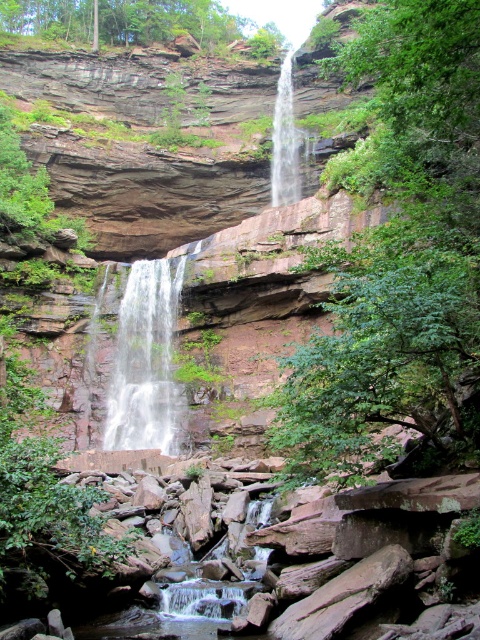
Who is shorter, smooth rock creek at lower center or white smooth waterfall at center?

With less height is smooth rock creek at lower center.

Who is more forward, (194,582) or (298,148)?

Point (194,582)

Find the location of a particular element. This screenshot has width=480, height=640. smooth rock creek at lower center is located at coordinates tap(180, 609).

Which is more to the right, green leafy tree at center or smooth rock creek at lower center?

Positioned to the right is green leafy tree at center.

Between point (349, 58) and point (98, 634), which one is positioned behind?

Point (349, 58)

Identify the location of green leafy tree at center. (402, 253).

Does point (140, 330) come farther from viewer compared to point (282, 68)?

No.

Is point (167, 369) positioned behind point (297, 140)?

No.

The height and width of the screenshot is (640, 480). Identify the location of white frothy water at center. (145, 362).